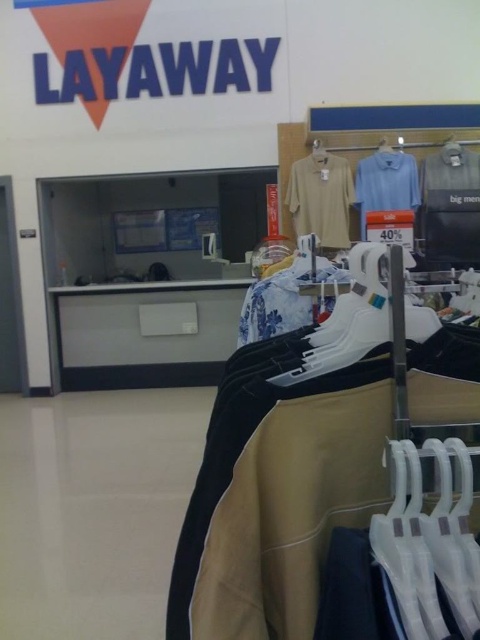
You are a store employee who needs to organize the clothing rack. You have a white plastic hanger at center and a floral cotton shirt at center. Which item takes up more space on the rack?

The floral cotton shirt at center takes up more space on the rack because the white plastic hanger at center occupies less space than it.

You are standing in the retail store and want to determine which of the two points, point (361, 253) or point (280, 326), is nearer to you. Based on the scene description, which point is closer?

Point (361, 253) is closer to the viewer than point (280, 326).

From the picture: You are a store employee who needs to reach the white plastic hanger at upper center from the white plastic hanger at center. Given that the store has a ladder that is 3 meters tall, will you be able to reach it?

The distance between the white plastic hanger at center and the white plastic hanger at upper center is 3.82 meters. Since the ladder is only 3 meters tall, you will not be able to reach the white plastic hanger at upper center with the available ladder.